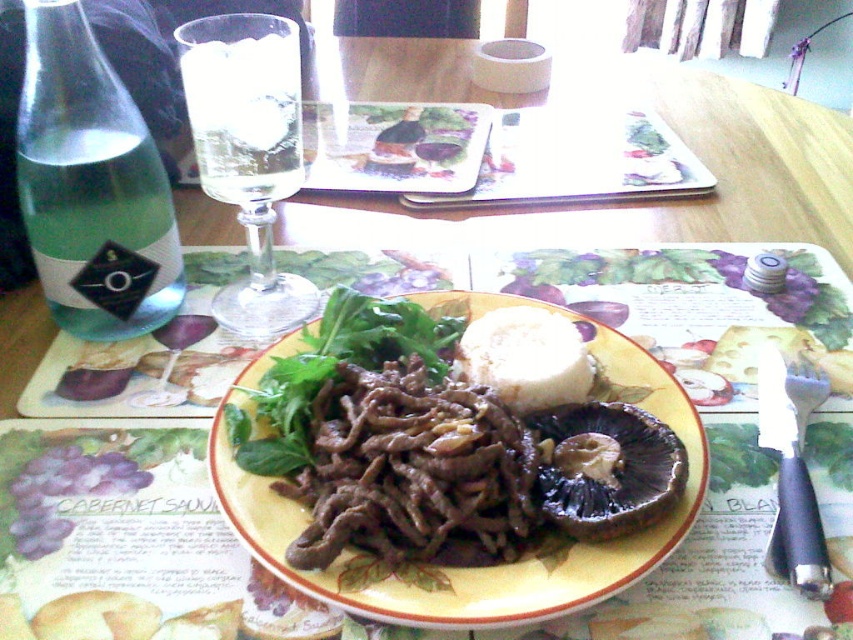
You are a server at a restaurant and need to place a new order on the table. The new order includes a large bottle of water and a dessert plate. Where should you place the large bottle of water and the dessert plate so they don,t interfere with the existing items? Consider the size and position of the green glass bottle at left and matte ceramic plate at center.

The green glass bottle at left is smaller than the matte ceramic plate at center, so you should place the large bottle of water where the green glass bottle at left is currently located and move the smaller bottle there. Then, place the dessert plate where the matte ceramic plate at center is, but since the existing plate is already at center, perhaps place the dessert plate to the right or left of it depending on space. However, since the existing plate is central, maybe the dessert plate should be placed.

You are a food critic evaluating this meal. You need to describe the relative sizes of the objects on the table. Which object is taller between the matte ceramic plate at center and the white fluffy bread at center?

The matte ceramic plate at center is taller than the white fluffy bread at center.

You are a person with a height of 5 feet 6 inches. You are sitting at the dining table and want to reach the point at coordinates point (56,148). Can you comfortably reach that point from your seated position?

The point (56,148) is 14.98 inches away from the viewer. Since the average comfortable reaching distance for someone 5 feet 6 inches tall is about 22 inches, you can comfortably reach that point from your seated position.